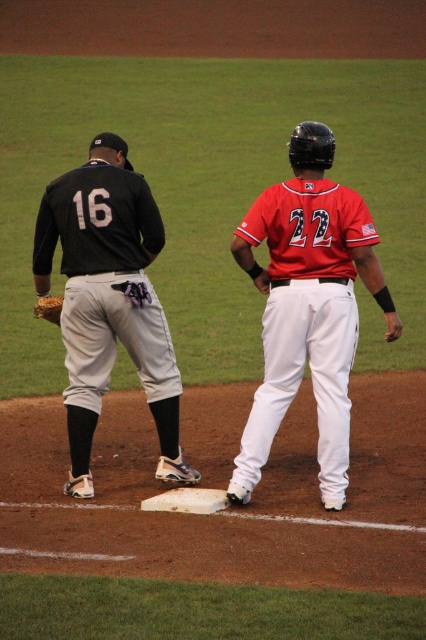
You are a photographer positioned behind home plate. You need to capture a photo of both the red matte jersey at center and the matte black jersey at left. Based on their heights, which player should you position closer to the camera to ensure both appear equally tall in the photo?

The red matte jersey at center has a lesser height compared to the matte black jersey at left. To make them appear equally tall in the photo, position the red matte jersey at center closer to the camera since it is shorter. This adjustment will help balance their sizes in the frame.

Based on the photo, you are a photographer standing at the edge of the baseball field. You want to take a closeup photo of the matte black jersey at left. The camera you are using has a minimum focusing distance of 8 meters. Will you be able to take the photo without moving closer?

The matte black jersey at left is 7.81 meters away from the camera. Since the minimum focusing distance is 8 meters, the camera cannot focus on the matte black jersey at left because it is too close. You need to move back to increase the distance to at least 8 meters.